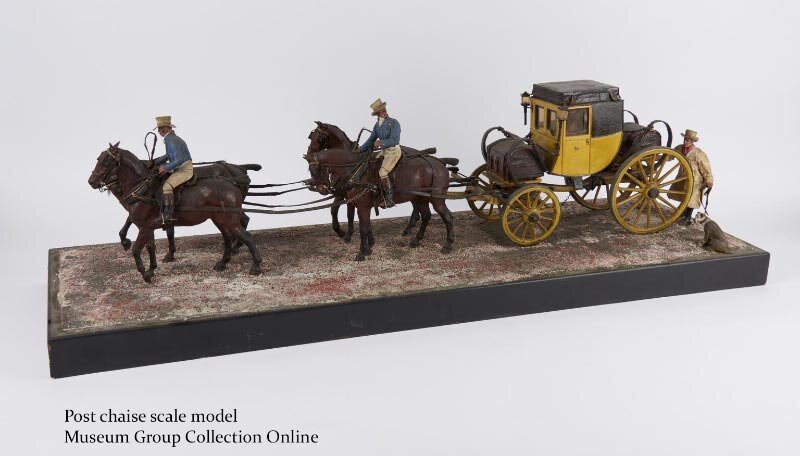
Where is `seats`? This screenshot has height=456, width=800. seats is located at coordinates (502, 144), (634, 131).